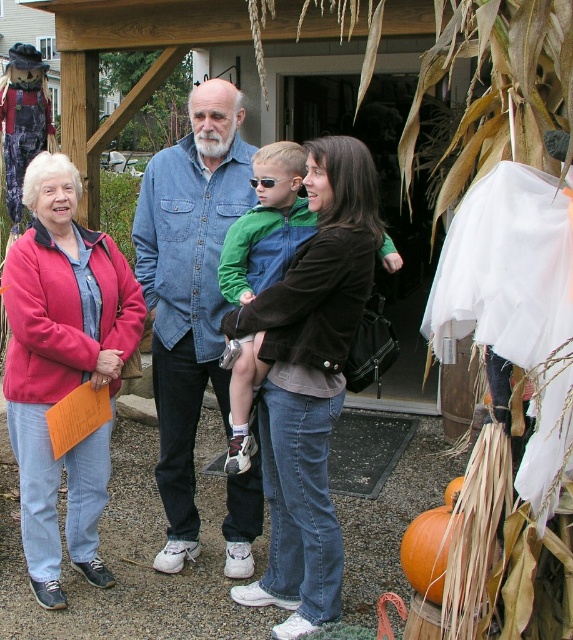
Can you confirm if matte brown jacket at center is positioned below green denim jacket at center?

Yes.

Between point (331, 276) and point (241, 394), which one is positioned in front?

Point (331, 276) is more forward.

Which is behind, point (336, 579) or point (260, 150)?

The point (260, 150) is more distant.

Locate an element on the screen. The image size is (573, 640). matte brown jacket at center is located at coordinates (311, 381).

Does matte brown jacket at center appear on the right side of orange matte pumpkin at lower right?

No, matte brown jacket at center is not to the right of orange matte pumpkin at lower right.

Is point (320, 232) less distant than point (445, 554)?

No, (320, 232) is behind (445, 554).

At what (x,y) coordinates should I click in order to perform the action: click on matte brown jacket at center. Please return your answer as a coordinate pair (x, y). This screenshot has width=573, height=640. Looking at the image, I should click on [311, 381].

Is point (262, 323) positioned behind point (229, 528)?

No.

Does matte brown jacket at center have a lesser height compared to denim jacket at center?

Correct, matte brown jacket at center is not as tall as denim jacket at center.

Which is in front, point (313, 209) or point (225, 420)?

Positioned in front is point (313, 209).

Where is `matte brown jacket at center`? Image resolution: width=573 pixels, height=640 pixels. matte brown jacket at center is located at coordinates (311, 381).